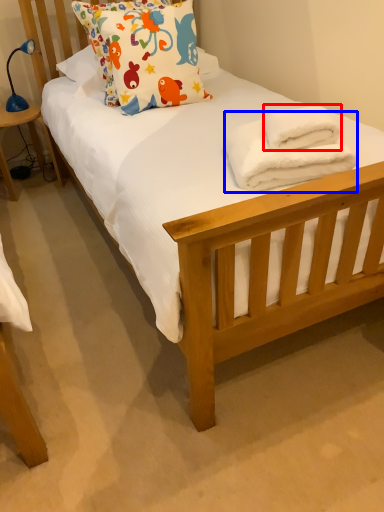
Question: Which object is closer to the camera taking this photo, bath towel (highlighted by a red box) or bath towel (highlighted by a blue box)?

Choices:
 (A) bath towel
 (B) bath towel

Answer: (B)